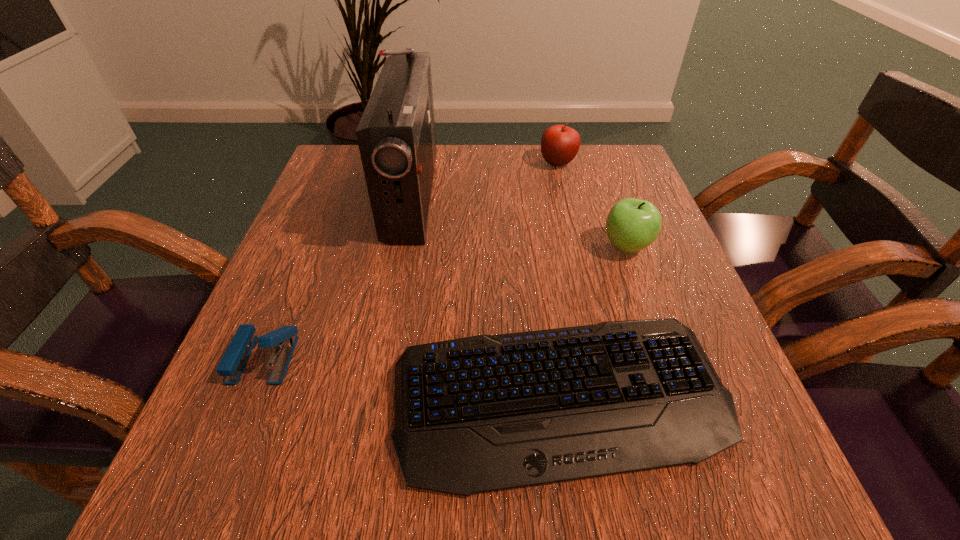
Image resolution: width=960 pixels, height=540 pixels. In the image, there is a desktop. Find the location of `free region at the left edge`. free region at the left edge is located at coordinates (330, 283).

Where is `vacant space at the right edge of the desktop`? vacant space at the right edge of the desktop is located at coordinates (708, 322).

Find the location of a particular element. free space at the far right corner of the desktop is located at coordinates (610, 172).

Where is `vacant area that lies between the farther apple and the nearer apple`? The height and width of the screenshot is (540, 960). vacant area that lies between the farther apple and the nearer apple is located at coordinates (592, 204).

Image resolution: width=960 pixels, height=540 pixels. I want to click on vacant area between the stapler and the nearer apple, so click(445, 302).

I want to click on free space between the stapler and the farther apple, so (x=411, y=260).

You are a GUI agent. You are given a task and a screenshot of the screen. Output one action in this format:
    pyautogui.click(x=<x>, y=<y>)
    Task: Click on the empty space that is in between the leftmost object and the farther apple
    
    Given the screenshot: What is the action you would take?
    pyautogui.click(x=411, y=260)

Where is `unoccupied position between the computer keyboard and the radio receiver`? The image size is (960, 540). unoccupied position between the computer keyboard and the radio receiver is located at coordinates (486, 298).

I want to click on free point between the tallest object and the farther apple, so click(485, 179).

I want to click on free space between the shortest object and the nearer apple, so click(593, 323).